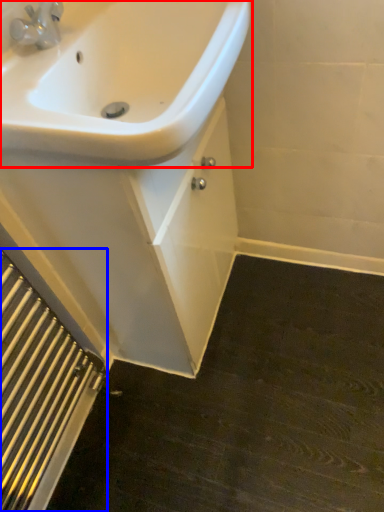
Question: Which object is further to the camera taking this photo, sink (highlighted by a red box) or radiator (highlighted by a blue box)?

Choices:
 (A) sink
 (B) radiator

Answer: (B)